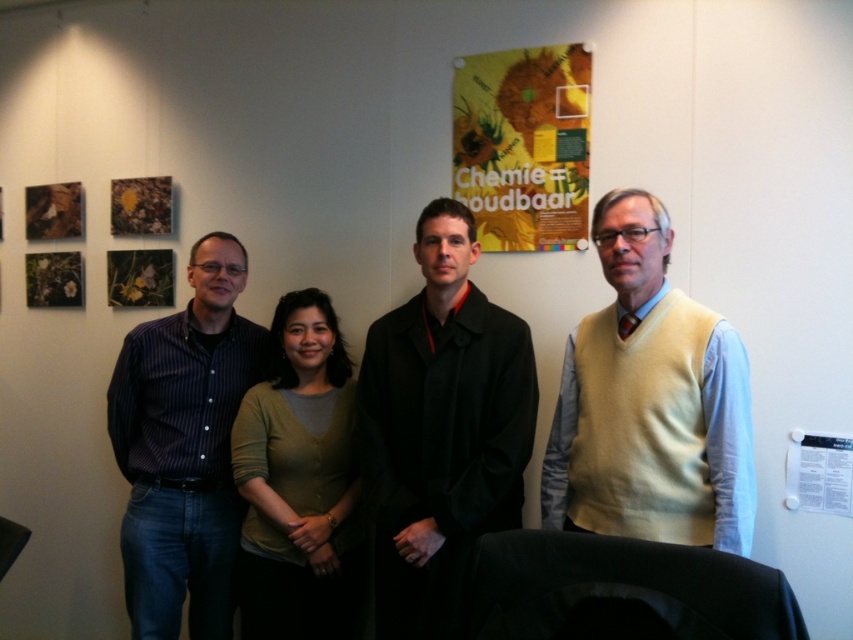
Does point (614, 316) come behind point (457, 250)?

No, it is in front of (457, 250).

Does yellow sweater vest at right have a lesser height compared to black matte coat at center?

Yes.

Describe the element at coordinates (650, 403) in the screenshot. I see `yellow sweater vest at right` at that location.

Where is `yellow sweater vest at right`? The height and width of the screenshot is (640, 853). yellow sweater vest at right is located at coordinates (650, 403).

Does dark blue striped shirt at left appear over green cardigan at center?

Indeed, dark blue striped shirt at left is positioned over green cardigan at center.

Can you confirm if dark blue striped shirt at left is bigger than green cardigan at center?

Indeed, dark blue striped shirt at left has a larger size compared to green cardigan at center.

This screenshot has height=640, width=853. What are the coordinates of `dark blue striped shirt at left` in the screenshot? It's located at (184, 449).

Which is more to the right, black matte coat at center or dark blue striped shirt at left?

Positioned to the right is black matte coat at center.

Measure the distance between black matte coat at center and dark blue striped shirt at left.

The distance of black matte coat at center from dark blue striped shirt at left is 68.00 centimeters.

This screenshot has width=853, height=640. What do you see at coordinates (440, 426) in the screenshot? I see `black matte coat at center` at bounding box center [440, 426].

Find the location of `black matte coat at center`. black matte coat at center is located at coordinates (440, 426).